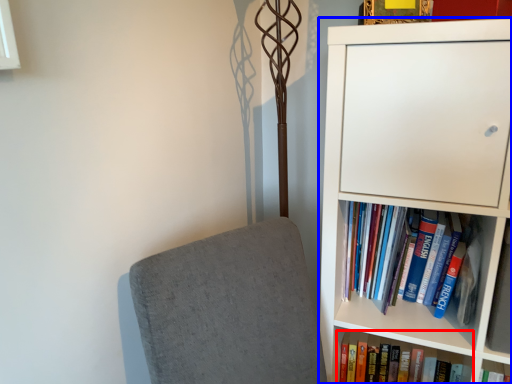
Question: Which of the following is the closest to the observer, book (highlighted by a red box) or bookcase (highlighted by a blue box)?

Choices:
 (A) book
 (B) bookcase

Answer: (B)